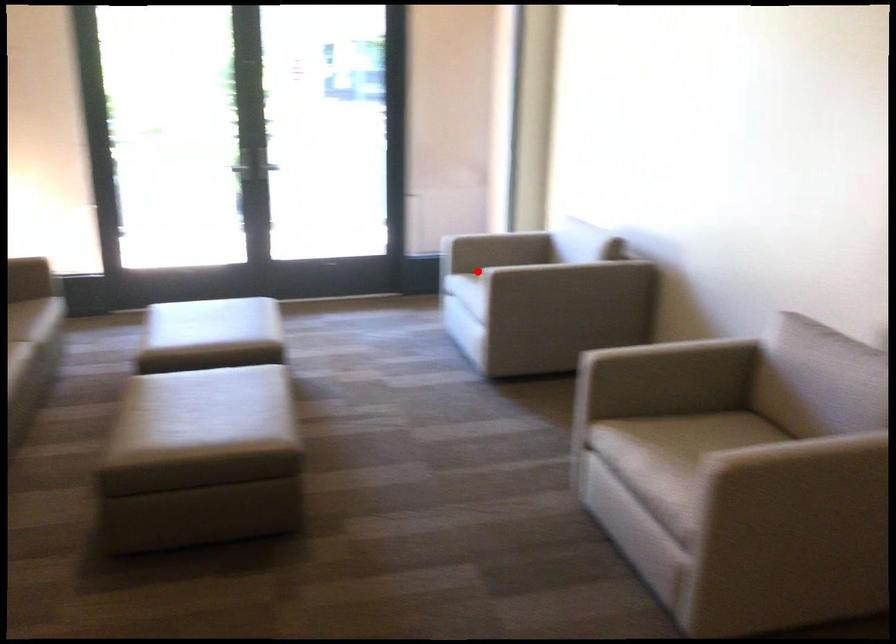
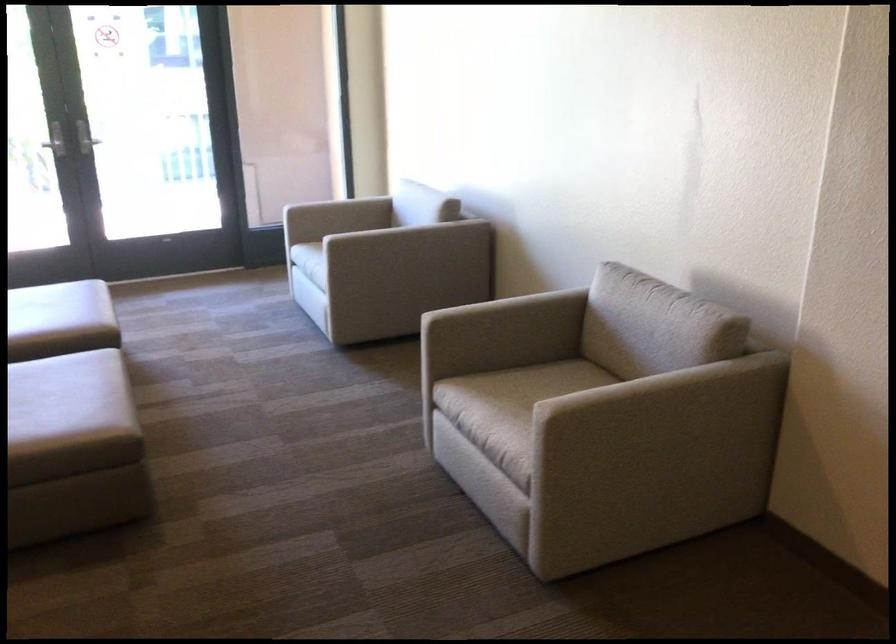
The point at the highlighted location is marked in the first image. Where is the corresponding point in the second image?

(316, 240)